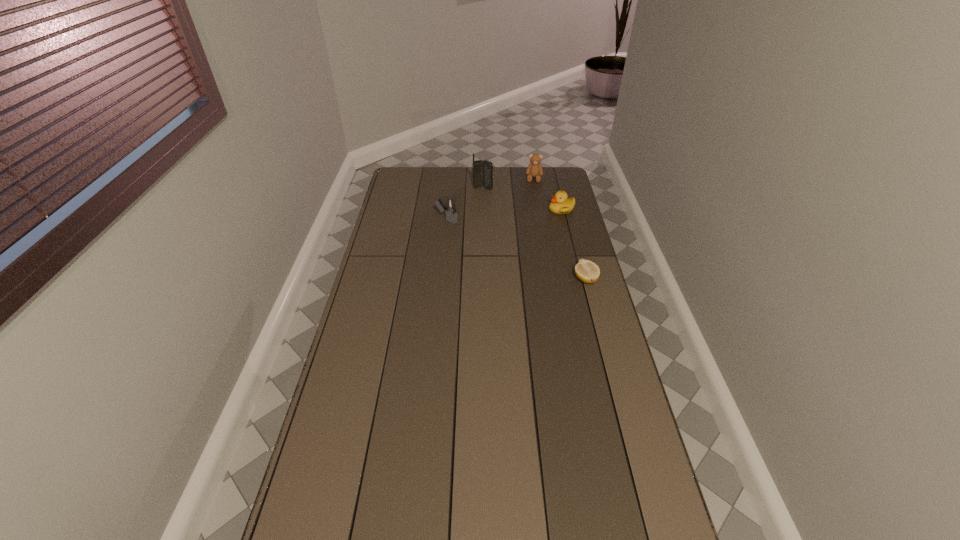
Select which object appears as the closest to the tallest object. Please provide its 2D coordinates. Your answer should be formatted as a tuple, i.e. [(x, y)], where the tuple contains the x and y coordinates of a point satisfying the conditions above.

[(534, 169)]

Locate an element on the screen. Image resolution: width=960 pixels, height=540 pixels. the closest object relative to the duckling is located at coordinates (534, 169).

Identify the location of vacant point that satisfies the following two spatial constraints: 1. on the front side of the fourth nearest object; 2. on the left side of the second shortest object. The height and width of the screenshot is (540, 960). coord(483,209).

Identify the location of vacant space that satisfies the following two spatial constraints: 1. on the back side of the duckling; 2. on the right side of the igniter. (448, 209).

What are the coordinates of `free space in the image that satisfies the following two spatial constraints: 1. on the front side of the farthest object; 2. on the left side of the shortest object` in the screenshot? It's located at (552, 279).

Where is `vacant area that satisfies the following two spatial constraints: 1. on the front side of the lemon; 2. on the left side of the leftmost object`? Image resolution: width=960 pixels, height=540 pixels. vacant area that satisfies the following two spatial constraints: 1. on the front side of the lemon; 2. on the left side of the leftmost object is located at coordinates (441, 279).

Where is `vacant space that satisfies the following two spatial constraints: 1. on the back side of the cellular telephone; 2. on the right side of the leftmost object`? vacant space that satisfies the following two spatial constraints: 1. on the back side of the cellular telephone; 2. on the right side of the leftmost object is located at coordinates (450, 188).